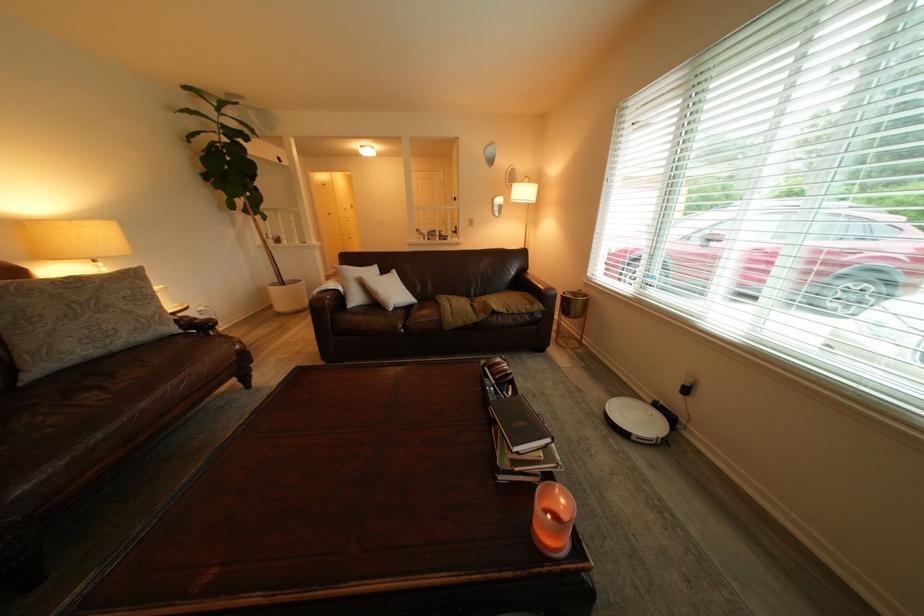
Image resolution: width=924 pixels, height=616 pixels. In order to click on sofa armrest in this screenshot , I will do `click(540, 292)`.